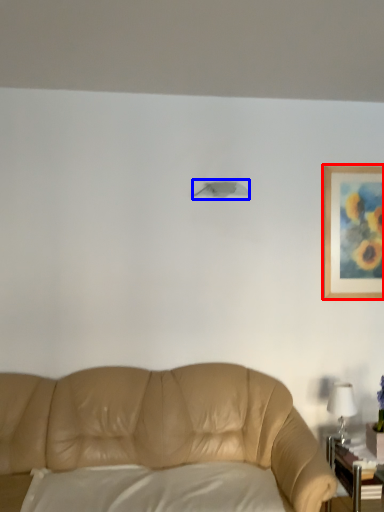
Question: Among these objects, which one is farthest to the camera, picture frame (highlighted by a red box) or lamp (highlighted by a blue box)?

Choices:
 (A) picture frame
 (B) lamp

Answer: (A)